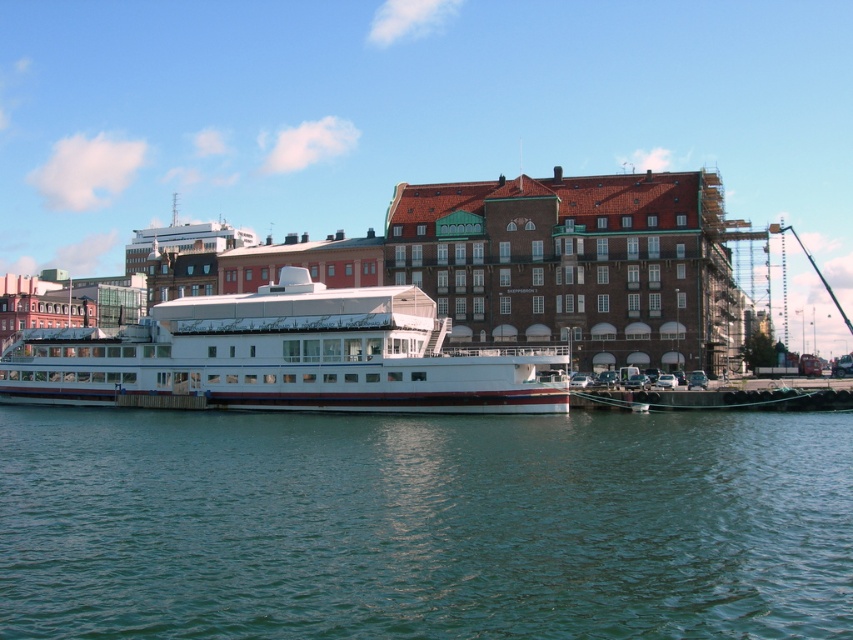
Question: Can you confirm if green water at lower center is positioned to the left of white glossy boat at center?

Choices:
 (A) yes
 (B) no

Answer: (B)

Question: Which object appears closest to the camera in this image?

Choices:
 (A) white glossy boat at center
 (B) green water at lower center

Answer: (B)

Question: Which point is farther from the camera taking this photo?

Choices:
 (A) [x=289, y=536]
 (B) [x=177, y=394]

Answer: (B)

Question: Can you confirm if green water at lower center is positioned to the right of white glossy boat at center?

Choices:
 (A) yes
 (B) no

Answer: (A)

Question: Does green water at lower center appear under white glossy boat at center?

Choices:
 (A) yes
 (B) no

Answer: (A)